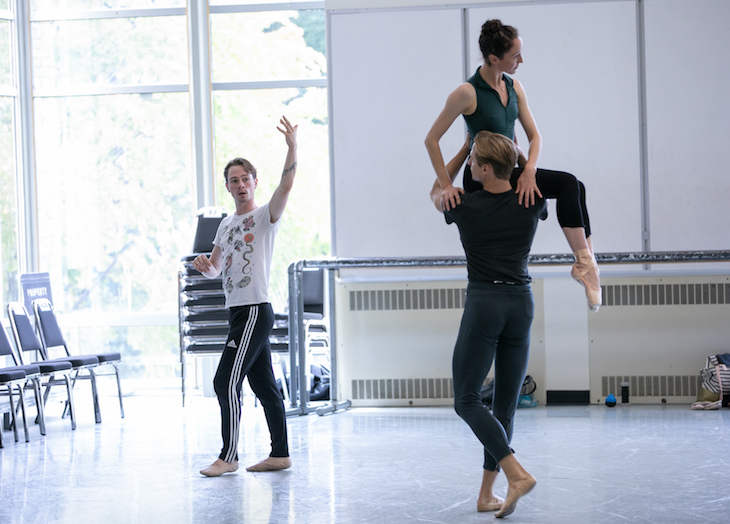
Locate an element on the screen. Image resolution: width=730 pixels, height=524 pixels. bags on the floor is located at coordinates (485, 396), (717, 385).